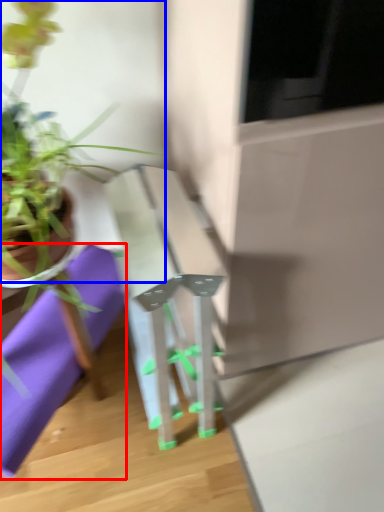
Question: Which point is further to the camera, cloth (highlighted by a red box) or houseplant (highlighted by a blue box)?

Choices:
 (A) cloth
 (B) houseplant

Answer: (A)